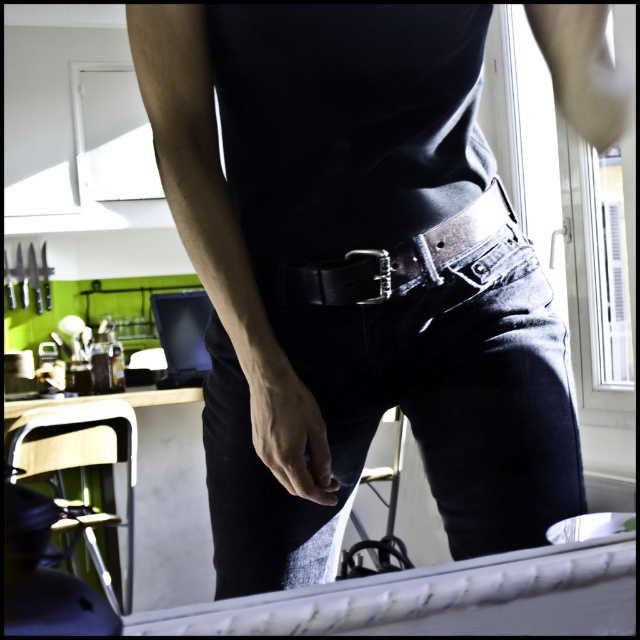
Question: Which of the following is the closest to the observer?

Choices:
 (A) matte black belt at center
 (B) smooth skin hand at lower center
 (C) leather belt at center

Answer: (A)

Question: Is denim at center smaller than metallic silver belt buckle at center?

Choices:
 (A) no
 (B) yes

Answer: (A)

Question: Does denim at center have a lesser width compared to smooth skin hand at lower center?

Choices:
 (A) no
 (B) yes

Answer: (A)

Question: Is leather belt at center thinner than metallic silver belt buckle at center?

Choices:
 (A) yes
 (B) no

Answer: (B)

Question: Which object is the closest to the matte black belt at center?

Choices:
 (A) denim at center
 (B) leather belt at center
 (C) smooth skin hand at lower center

Answer: (A)

Question: Which point is farther to the camera?

Choices:
 (A) leather belt at center
 (B) smooth skin hand at lower center
 (C) denim at center
 (D) metallic silver belt buckle at center

Answer: (D)